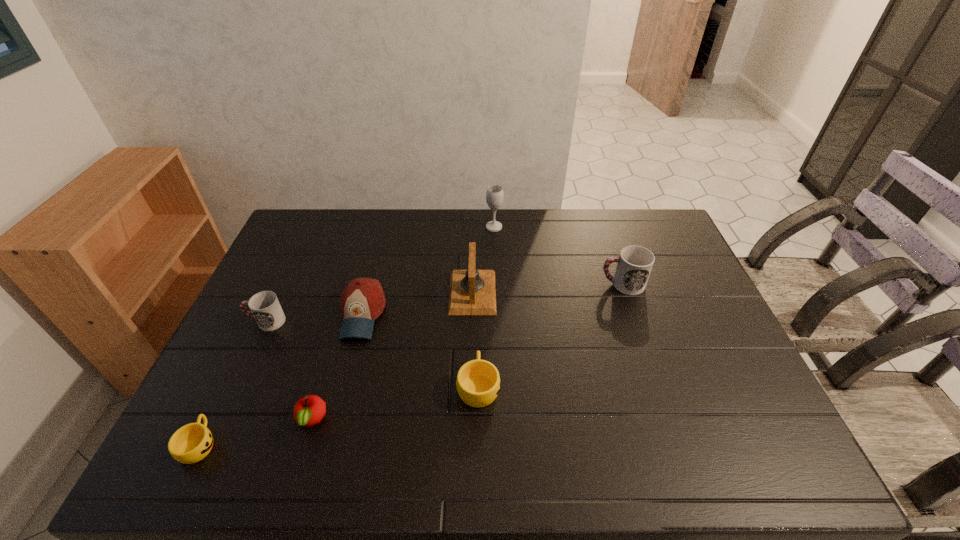
I want to click on wineglass, so [x=494, y=195].

You are a GUI agent. You are given a task and a screenshot of the screen. Output one action in this format:
    pyautogui.click(x=<x>, y=<y>)
    Task: Click on the farthest object
    
    Given the screenshot: What is the action you would take?
    pyautogui.click(x=494, y=195)

At what (x,y) coordinates should I click in order to perform the action: click on bell. Please return your answer as a coordinate pair (x, y). This screenshot has height=540, width=960. Looking at the image, I should click on (472, 292).

At what (x,y) coordinates should I click in order to perform the action: click on the bigger red cup. Please return your answer as a coordinate pair (x, y). Looking at the image, I should click on (634, 265).

Identify the location of the right red cup. (634, 265).

The width and height of the screenshot is (960, 540). What are the coordinates of `red baseball cap` in the screenshot? It's located at (362, 301).

Find the location of a particular element. This screenshot has height=540, width=960. the nearer red cup is located at coordinates (266, 310).

Locate an element on the screen. the smaller red cup is located at coordinates (266, 310).

Where is `the third tallest cup`? the third tallest cup is located at coordinates (478, 383).

Find the location of a particular element. The width and height of the screenshot is (960, 540). the right beige cup is located at coordinates (478, 383).